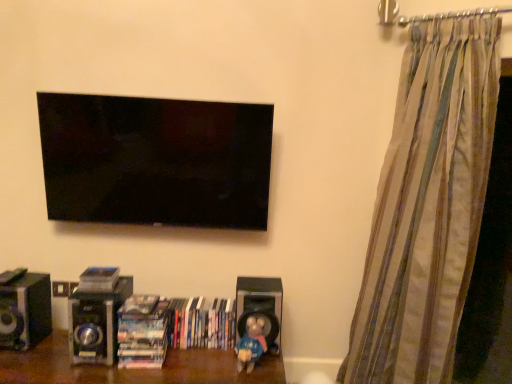
The width and height of the screenshot is (512, 384). I want to click on free space between black matte speaker at lower center, which is the 1th speaker in right-to-left order, and hardcover books at center, which is the first book from right to left, so click(209, 349).